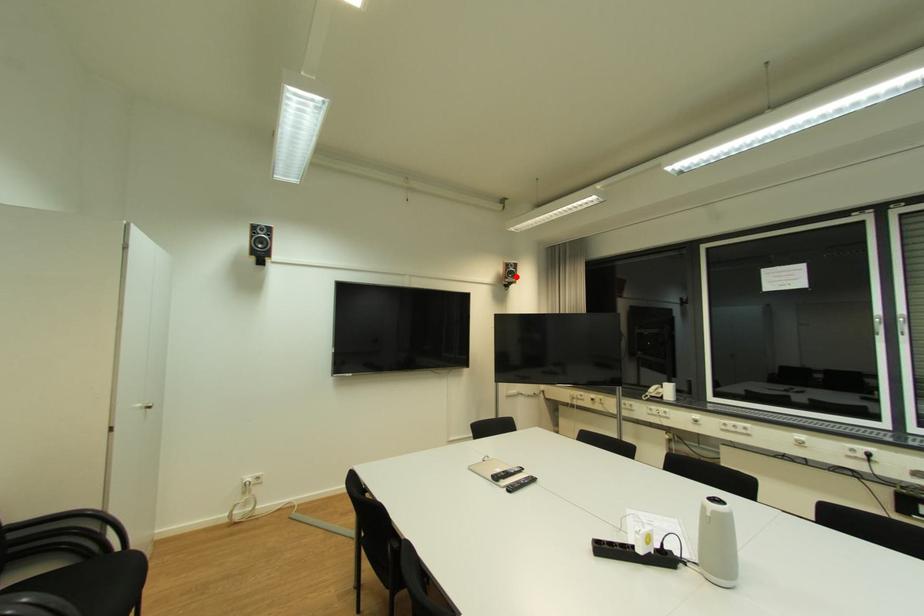
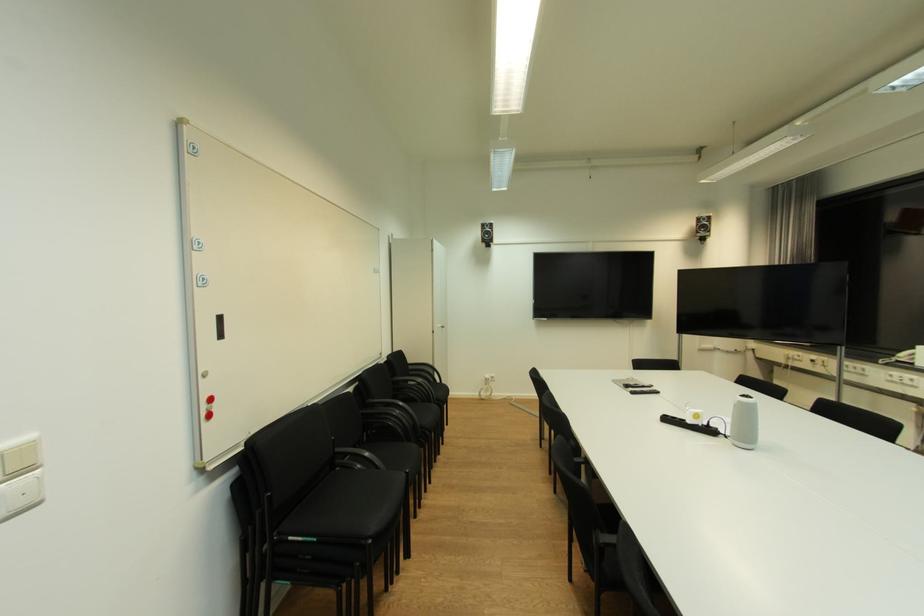
Question: I am providing you with two images of the same scene from different viewpoints. A red point is marked on the first image. Can you still see the location of the red point in image 2?

Choices:
 (A) Yes
 (B) No

Answer: (A)